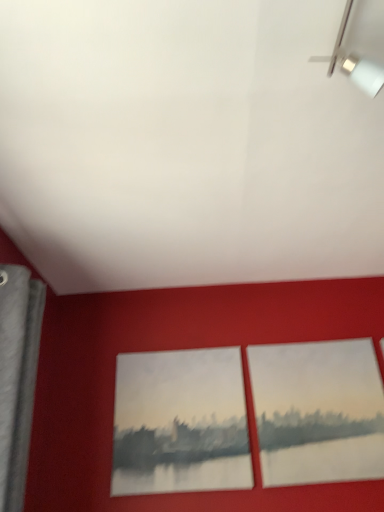
This screenshot has width=384, height=512. What do you see at coordinates (318, 411) in the screenshot?
I see `matte red picture frame at center, placed as the first picture frame when sorted from right to left` at bounding box center [318, 411].

Measure the distance between matte red picture frame at center, which appears as the second picture frame when viewed from the left, and camera.

A distance of 5.59 feet exists between matte red picture frame at center, which appears as the second picture frame when viewed from the left, and camera.

The height and width of the screenshot is (512, 384). Find the location of `matte red picture frame at center, which appears as the second picture frame when viewed from the left`. matte red picture frame at center, which appears as the second picture frame when viewed from the left is located at coordinates (318, 411).

What do you see at coordinates (180, 423) in the screenshot? The image size is (384, 512). I see `matte canvas painting at center, which ranks as the 1th picture frame in left-to-right order` at bounding box center [180, 423].

Where is `matte canvas painting at center, which ranks as the 1th picture frame in left-to-right order`? Image resolution: width=384 pixels, height=512 pixels. matte canvas painting at center, which ranks as the 1th picture frame in left-to-right order is located at coordinates (180, 423).

How much space does matte canvas painting at center, which ranks as the 1th picture frame in left-to-right order, occupy horizontally?

1.76 inches.

Locate an element on the screen. matte red picture frame at center, which appears as the second picture frame when viewed from the left is located at coordinates (318, 411).

Considering the positions of objects matte red picture frame at center, which appears as the second picture frame when viewed from the left, and matte canvas painting at center, placed as the 2th picture frame when sorted from right to left, in the image provided, who is more to the right, matte red picture frame at center, which appears as the second picture frame when viewed from the left, or matte canvas painting at center, placed as the 2th picture frame when sorted from right to left,?

From the viewer's perspective, matte red picture frame at center, which appears as the second picture frame when viewed from the left, appears more on the right side.

Does matte red picture frame at center, which appears as the second picture frame when viewed from the left, come in front of matte canvas painting at center, which ranks as the 1th picture frame in left-to-right order?

Yes, matte red picture frame at center, which appears as the second picture frame when viewed from the left, is closer to the viewer.

Is point (366, 464) in front of point (166, 450)?

That is True.

From the image's perspective, which is above, matte red picture frame at center, placed as the first picture frame when sorted from right to left, or matte canvas painting at center, which ranks as the 1th picture frame in left-to-right order?

From the image's view, matte red picture frame at center, placed as the first picture frame when sorted from right to left, is above.

From a real-world perspective, is matte red picture frame at center, which appears as the second picture frame when viewed from the left, above or below matte canvas painting at center, which ranks as the 1th picture frame in left-to-right order?

matte red picture frame at center, which appears as the second picture frame when viewed from the left, is situated higher than matte canvas painting at center, which ranks as the 1th picture frame in left-to-right order, in the real world.

Considering the sizes of objects matte red picture frame at center, placed as the first picture frame when sorted from right to left, and matte canvas painting at center, placed as the 2th picture frame when sorted from right to left, in the image provided, who is thinner, matte red picture frame at center, placed as the first picture frame when sorted from right to left, or matte canvas painting at center, placed as the 2th picture frame when sorted from right to left,?

With smaller width is matte canvas painting at center, placed as the 2th picture frame when sorted from right to left.

Is matte red picture frame at center, which appears as the second picture frame when viewed from the left, taller or shorter than matte canvas painting at center, which ranks as the 1th picture frame in left-to-right order?

Considering their sizes, matte red picture frame at center, which appears as the second picture frame when viewed from the left, has more height than matte canvas painting at center, which ranks as the 1th picture frame in left-to-right order.

Does matte red picture frame at center, which appears as the second picture frame when viewed from the left, have a smaller size compared to matte canvas painting at center, which ranks as the 1th picture frame in left-to-right order?

Incorrect, matte red picture frame at center, which appears as the second picture frame when viewed from the left, is not smaller in size than matte canvas painting at center, which ranks as the 1th picture frame in left-to-right order.

Choose the correct answer: Is matte red picture frame at center, placed as the first picture frame when sorted from right to left, inside matte canvas painting at center, which ranks as the 1th picture frame in left-to-right order, or outside it?

matte red picture frame at center, placed as the first picture frame when sorted from right to left, is not inside matte canvas painting at center, which ranks as the 1th picture frame in left-to-right order, it's outside.

Is matte red picture frame at center, placed as the first picture frame when sorted from right to left, with matte canvas painting at center, placed as the 2th picture frame when sorted from right to left?

No, matte red picture frame at center, placed as the first picture frame when sorted from right to left, is not making contact with matte canvas painting at center, placed as the 2th picture frame when sorted from right to left.

Is matte red picture frame at center, placed as the first picture frame when sorted from right to left, aimed at matte canvas painting at center, placed as the 2th picture frame when sorted from right to left?

No, matte red picture frame at center, placed as the first picture frame when sorted from right to left, is not oriented towards matte canvas painting at center, placed as the 2th picture frame when sorted from right to left.

How distant is matte red picture frame at center, which appears as the second picture frame when viewed from the left, from matte canvas painting at center, which ranks as the 1th picture frame in left-to-right order?

A distance of 13.02 inches exists between matte red picture frame at center, which appears as the second picture frame when viewed from the left, and matte canvas painting at center, which ranks as the 1th picture frame in left-to-right order.

At what (x,y) coordinates should I click in order to perform the action: click on picture frame behind the matte red picture frame at center, placed as the first picture frame when sorted from right to left. Please return your answer as a coordinate pair (x, y). This screenshot has height=512, width=384. Looking at the image, I should click on (180, 423).

Considering the positions of objects matte canvas painting at center, which ranks as the 1th picture frame in left-to-right order, and matte red picture frame at center, which appears as the second picture frame when viewed from the left, in the image provided, who is more to the right, matte canvas painting at center, which ranks as the 1th picture frame in left-to-right order, or matte red picture frame at center, which appears as the second picture frame when viewed from the left,?

matte red picture frame at center, which appears as the second picture frame when viewed from the left, is more to the right.

Does matte canvas painting at center, which ranks as the 1th picture frame in left-to-right order, lie in front of matte red picture frame at center, placed as the first picture frame when sorted from right to left?

No, the depth of matte canvas painting at center, which ranks as the 1th picture frame in left-to-right order, is greater than that of matte red picture frame at center, placed as the first picture frame when sorted from right to left.

Does point (205, 433) come farther from viewer compared to point (348, 401)?

No.

From the image's perspective, is matte canvas painting at center, which ranks as the 1th picture frame in left-to-right order, on top of matte red picture frame at center, placed as the first picture frame when sorted from right to left?

No, from the image's perspective, matte canvas painting at center, which ranks as the 1th picture frame in left-to-right order, is not over matte red picture frame at center, placed as the first picture frame when sorted from right to left.

From a real-world perspective, is matte canvas painting at center, placed as the 2th picture frame when sorted from right to left, located beneath matte red picture frame at center, which appears as the second picture frame when viewed from the left?

Yes, from a real-world perspective, matte canvas painting at center, placed as the 2th picture frame when sorted from right to left, is beneath matte red picture frame at center, which appears as the second picture frame when viewed from the left.

Does matte canvas painting at center, which ranks as the 1th picture frame in left-to-right order, have a lesser width compared to matte red picture frame at center, which appears as the second picture frame when viewed from the left?

Correct, the width of matte canvas painting at center, which ranks as the 1th picture frame in left-to-right order, is less than that of matte red picture frame at center, which appears as the second picture frame when viewed from the left.

Is matte canvas painting at center, placed as the 2th picture frame when sorted from right to left, taller or shorter than matte red picture frame at center, which appears as the second picture frame when viewed from the left?

Considering their sizes, matte canvas painting at center, placed as the 2th picture frame when sorted from right to left, has less height than matte red picture frame at center, which appears as the second picture frame when viewed from the left.

Between matte canvas painting at center, placed as the 2th picture frame when sorted from right to left, and matte red picture frame at center, which appears as the second picture frame when viewed from the left, which one has smaller size?

With smaller size is matte canvas painting at center, placed as the 2th picture frame when sorted from right to left.

Is matte canvas painting at center, placed as the 2th picture frame when sorted from right to left, situated inside matte red picture frame at center, placed as the first picture frame when sorted from right to left, or outside?

matte canvas painting at center, placed as the 2th picture frame when sorted from right to left, is spatially situated outside matte red picture frame at center, placed as the first picture frame when sorted from right to left.

Are matte canvas painting at center, placed as the 2th picture frame when sorted from right to left, and matte red picture frame at center, placed as the first picture frame when sorted from right to left, making contact?

No, matte canvas painting at center, placed as the 2th picture frame when sorted from right to left, is not making contact with matte red picture frame at center, placed as the first picture frame when sorted from right to left.

Is matte canvas painting at center, placed as the 2th picture frame when sorted from right to left, aimed at matte red picture frame at center, which appears as the second picture frame when viewed from the left?

No, matte canvas painting at center, placed as the 2th picture frame when sorted from right to left, is not turned towards matte red picture frame at center, which appears as the second picture frame when viewed from the left.

In order to click on picture frame that is below the matte red picture frame at center, placed as the first picture frame when sorted from right to left (from the image's perspective) in this screenshot , I will do `click(180, 423)`.

Image resolution: width=384 pixels, height=512 pixels. In order to click on picture frame on the left of matte red picture frame at center, placed as the first picture frame when sorted from right to left in this screenshot , I will do `click(180, 423)`.

In order to click on picture frame that appears behind the matte red picture frame at center, which appears as the second picture frame when viewed from the left in this screenshot , I will do `click(180, 423)`.